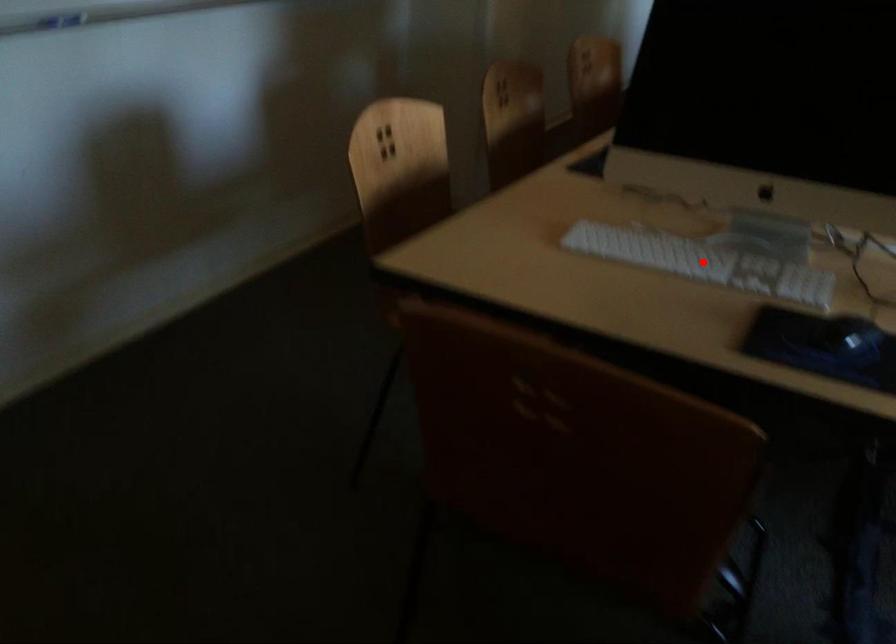
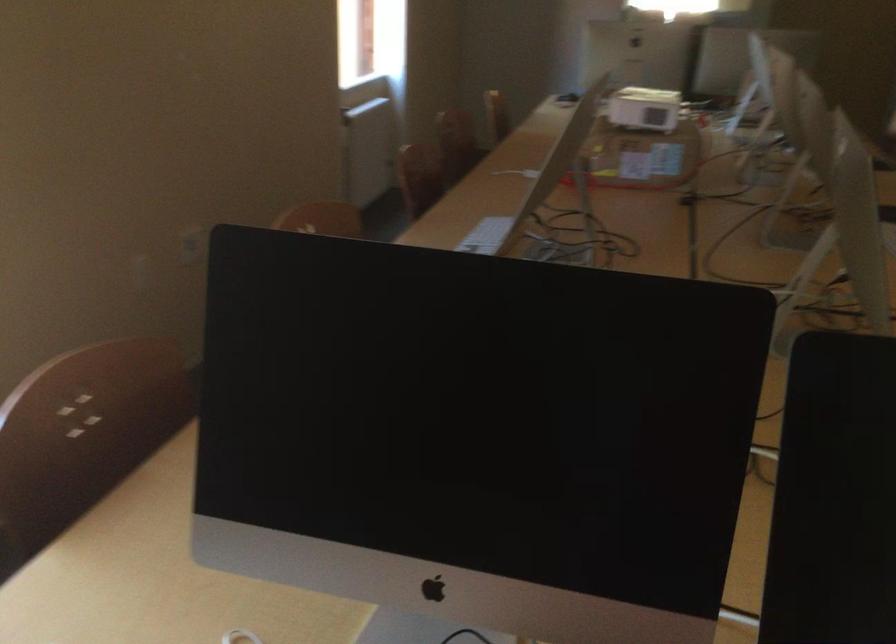
Question: I am providing you with two images of the same scene from different viewpoints. A red point is marked on the first image. At the location where the point appears in image 1, is it still visible in image 2?

Choices:
 (A) Yes
 (B) No

Answer: (B)